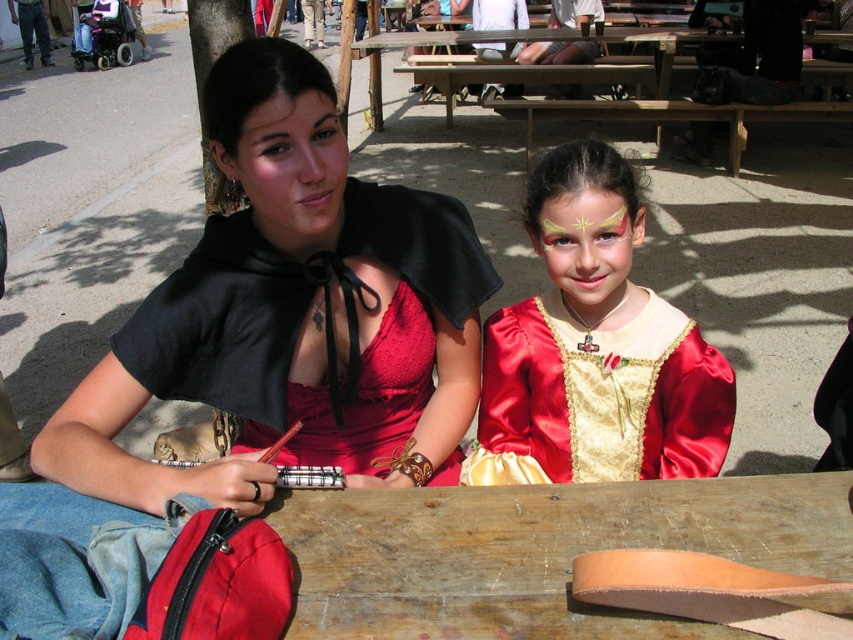
You are setting up a booth at the event and need to place a decorative banner between the wooden at center and the matte black cape at upper center. Which object should the banner be placed closer to to ensure it fits within the space?

The banner should be placed closer to the matte black cape at upper center because the wooden at center is wider, leaving more space on the cape side for the banner to fit properly.

You are a photographer at the event and want to capture both the satin gold dress at center and the shiny gold face paint at center in a single frame. Given that your camera has a fixed focus on the wider object, will the narrower object still be in focus?

The satin gold dress at center is wider than the shiny gold face paint at center. Since the camera focuses on the wider object, the narrower shiny gold face paint at center will also be in focus as it is within the same frame.

You are organizing a photo shoot and need to ensure the wooden at center and the satin gold dress at center fit within a 1.5 meter wide backdrop. Given the objects description, will both items fit side by side without overlapping?

The wooden at center is wider than the satin gold dress at center. However, since the total width of both items combined may exceed 1.5 meters, it depends on their exact dimensions. The description only states the wooden item is wider, but not by how much. Without specific measurements, we cannot confirm if they will fit side by side within the 1.5 meter backdrop.